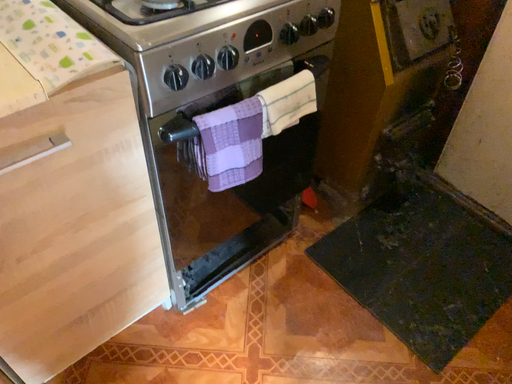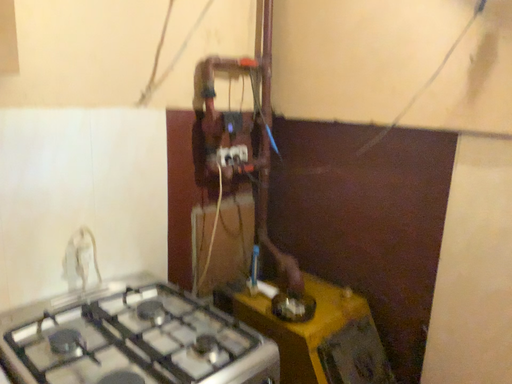
Question: Which way did the camera rotate in the video?

Choices:
 (A) rotated upward
 (B) rotated downward

Answer: (A)